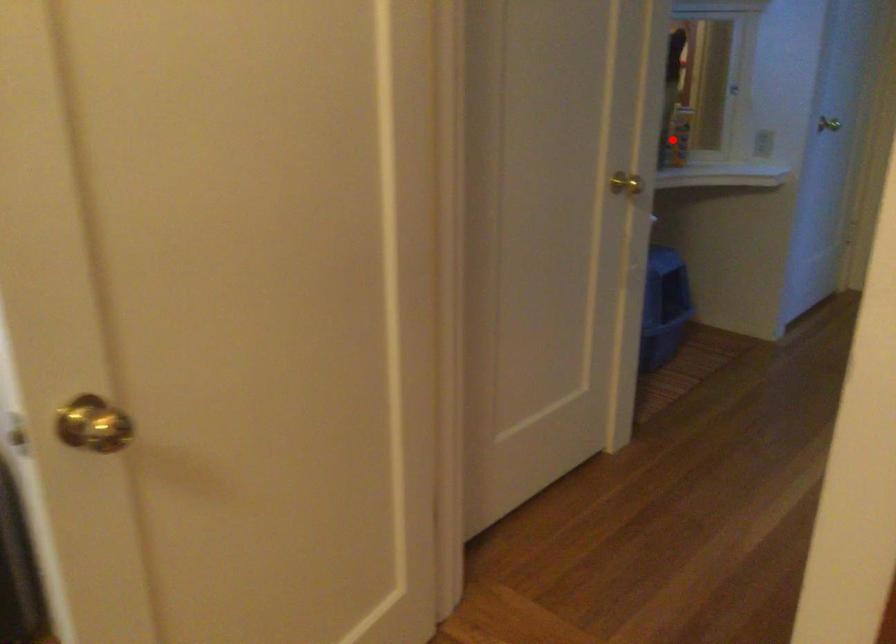
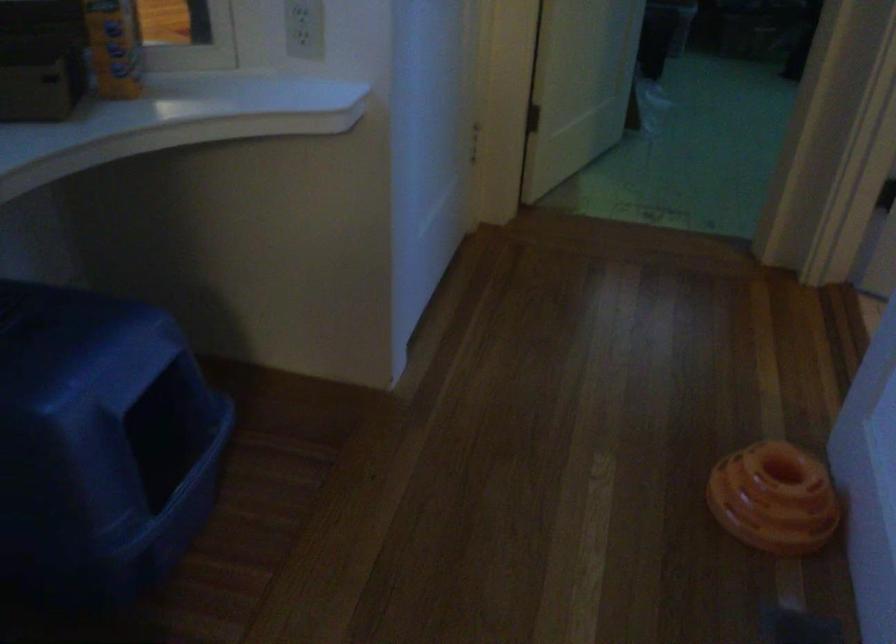
Question: I am providing you with two images of the same scene from different viewpoints. A red point is marked on the first image. Can you still see the location of the red point in image 2?

Choices:
 (A) Yes
 (B) No

Answer: (A)